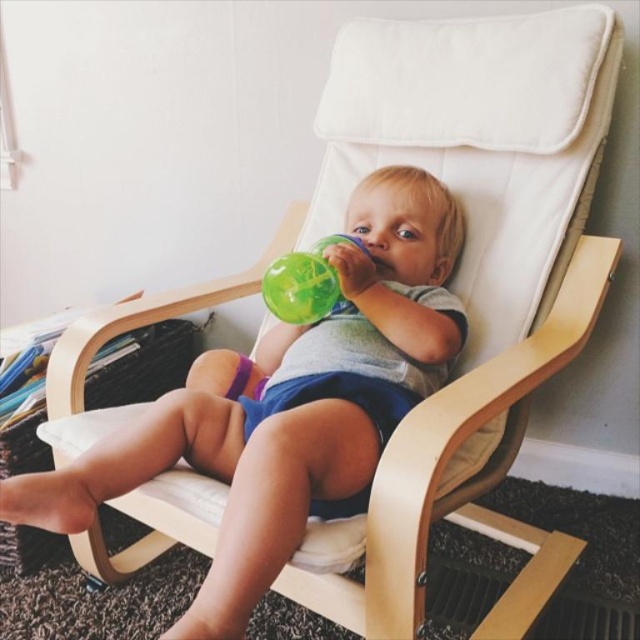
Question: Does matte green sippy cup at center lie in front of translucent green cup at center?

Choices:
 (A) yes
 (B) no

Answer: (A)

Question: Among these objects, which one is farthest from the camera?

Choices:
 (A) translucent green cup at center
 (B) matte green sippy cup at center

Answer: (A)

Question: Which point is farther from the camera taking this photo?

Choices:
 (A) (346, 284)
 (B) (321, 276)

Answer: (A)

Question: Is the position of matte green sippy cup at center more distant than that of translucent green cup at center?

Choices:
 (A) yes
 (B) no

Answer: (B)

Question: Which point appears farthest from the camera in this image?

Choices:
 (A) (392, 294)
 (B) (292, 269)

Answer: (A)

Question: Does matte green sippy cup at center have a greater width compared to translucent green cup at center?

Choices:
 (A) yes
 (B) no

Answer: (A)